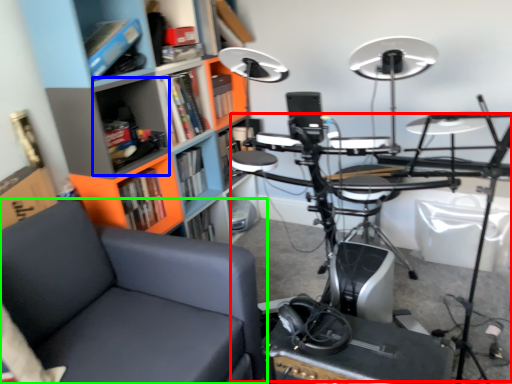
Question: Which object is positioned closest to computer desk (highlighted by a red box)? Select from shelf (highlighted by a blue box) and chair (highlighted by a green box).

Choices:
 (A) shelf
 (B) chair

Answer: (B)